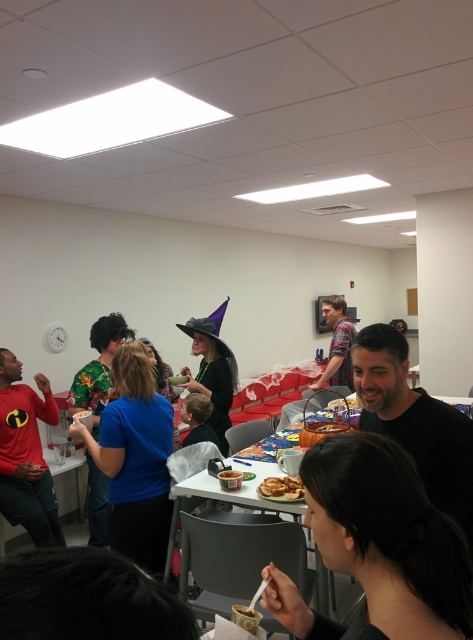
Can you confirm if red matte shirt at left is wider than golden crispy sandwich at center?

Indeed, red matte shirt at left has a greater width compared to golden crispy sandwich at center.

Does red matte shirt at left have a smaller size compared to golden crispy sandwich at center?

Incorrect, red matte shirt at left is not smaller in size than golden crispy sandwich at center.

Identify the location of red matte shirt at left. (26, 454).

Find the location of a particular element. This screenshot has width=473, height=640. red matte shirt at left is located at coordinates (26, 454).

Which is in front, point (131, 509) or point (211, 336)?

Point (131, 509) is in front.

Is point (142, 381) less distant than point (200, 332)?

Yes, point (142, 381) is in front of point (200, 332).

What do you see at coordinates (134, 460) in the screenshot?
I see `blue fabric shirt at center` at bounding box center [134, 460].

The height and width of the screenshot is (640, 473). Find the location of `blue fabric shirt at center`. blue fabric shirt at center is located at coordinates point(134,460).

Is red matte shirt at left further to camera compared to matte black witch hat at center?

No, it is in front of matte black witch hat at center.

Is point (31, 528) positioned behind point (222, 344)?

No.

Where is `red matte shirt at left`? The image size is (473, 640). red matte shirt at left is located at coordinates (26, 454).